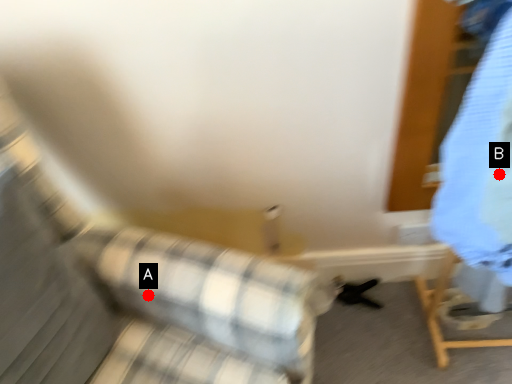
Question: Two points are circled on the image, labeled by A and B beside each circle. Which point is further to the camera?

Choices:
 (A) A is further
 (B) B is further

Answer: (A)